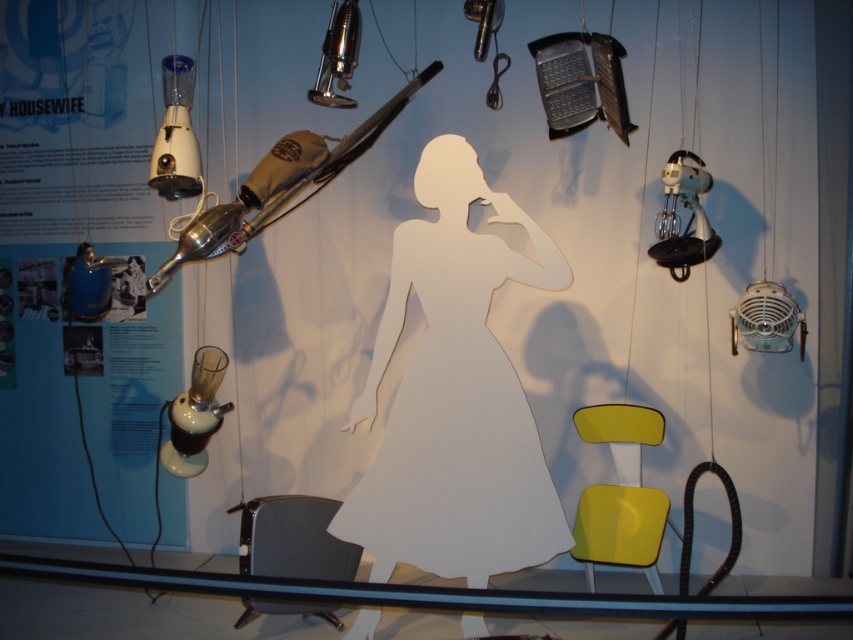
You are a visitor at the museum and see the white paper figure at center and the white plastic blender at upper left. Which object is taller?

The white paper figure at center is taller than the white plastic blender at upper left.

You are standing in front of the museum exhibit and notice two points marked in the display. The first point is at coordinate point (55, 566) and the second is at point (340, 564). Which of these points is closer to you?

Point (55, 566) is in front of point (340, 564), so it is closer to you.

You are a museum visitor standing in front of the display. You want to place a small souvenir on the transparent glass table at lower center and the matte white lamp at lower left. Which object can accommodate a larger souvenir?

The transparent glass table at lower center is larger in size than the matte white lamp at lower left, so it can accommodate a larger souvenir.